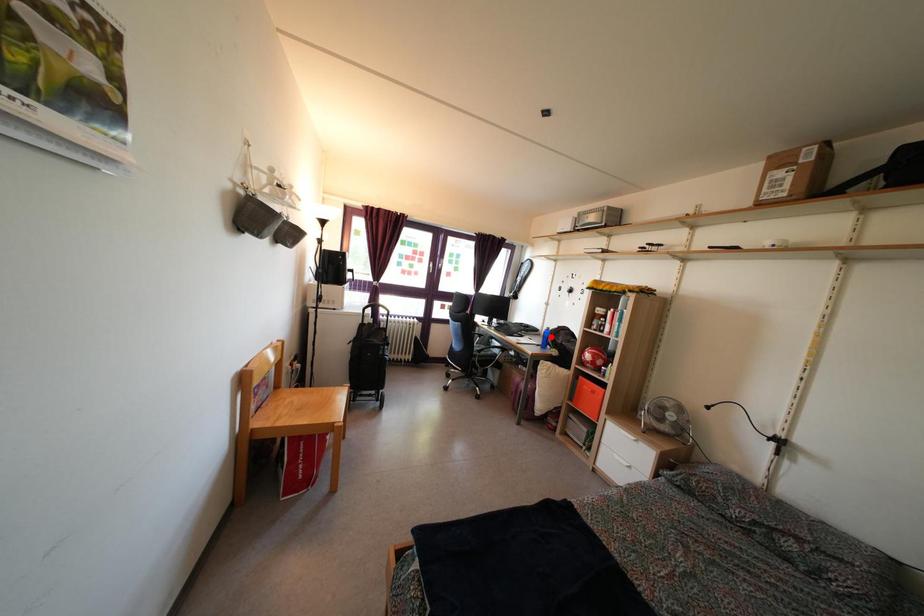
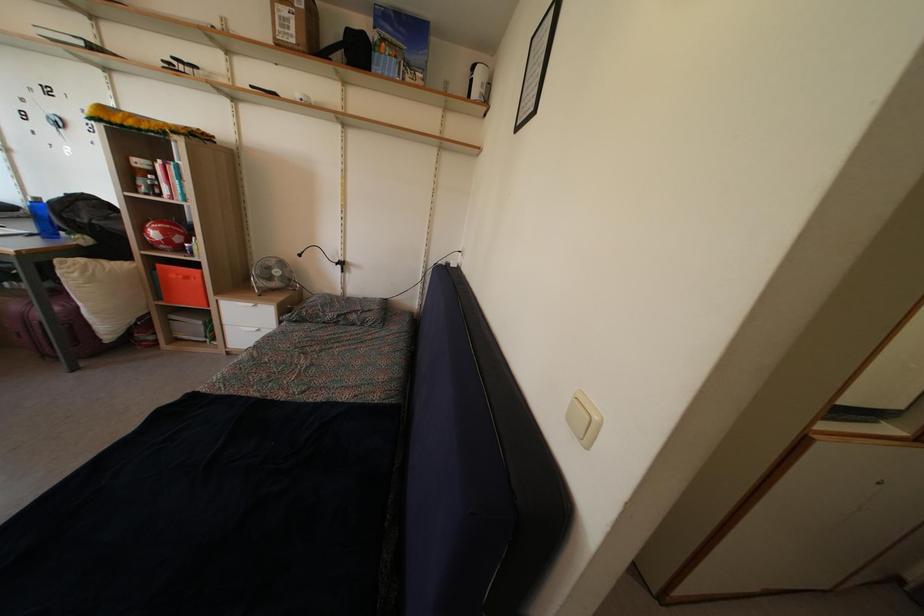
Question: I am providing you with two images of the same scene from different viewpoints. In image1, a red point is highlighted. Considering the same 3D point in image2, which of the following is correct?

Choices:
 (A) It is closer
 (B) It is farther

Answer: (B)